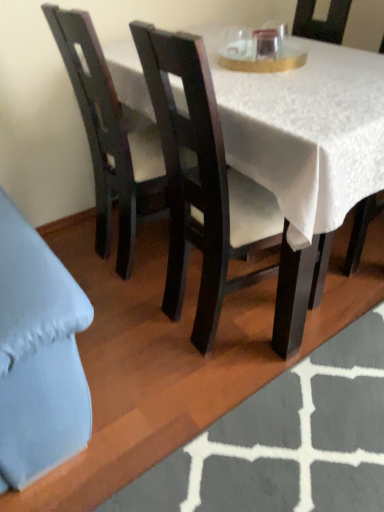
Identify the location of vacant region in front of dark wood chair at left, the first chair viewed from the left. (126, 311).